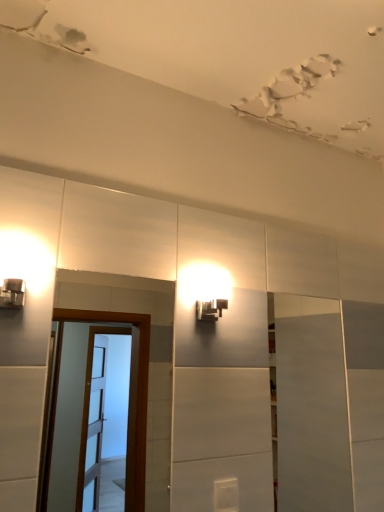
Question: Can you confirm if white plastic light switch at lower center is smaller than white glossy door at right?

Choices:
 (A) yes
 (B) no

Answer: (A)

Question: Is white plastic light switch at lower center with white glossy door at right?

Choices:
 (A) yes
 (B) no

Answer: (B)

Question: From the image's perspective, is white plastic light switch at lower center located above white glossy door at right?

Choices:
 (A) yes
 (B) no

Answer: (B)

Question: Is white plastic light switch at lower center to the right of white glossy door at right from the viewer's perspective?

Choices:
 (A) yes
 (B) no

Answer: (B)

Question: Is white plastic light switch at lower center thinner than white glossy door at right?

Choices:
 (A) no
 (B) yes

Answer: (A)

Question: From a real-world perspective, is white plastic light switch at lower center located beneath white glossy door at right?

Choices:
 (A) yes
 (B) no

Answer: (A)

Question: Could you tell me if white plastic light switch at lower center is facing matte black light fixture at upper center?

Choices:
 (A) no
 (B) yes

Answer: (A)

Question: Considering the relative sizes of white plastic light switch at lower center and matte black light fixture at upper center in the image provided, is white plastic light switch at lower center shorter than matte black light fixture at upper center?

Choices:
 (A) no
 (B) yes

Answer: (A)

Question: Is there a large distance between white plastic light switch at lower center and matte black light fixture at upper center?

Choices:
 (A) yes
 (B) no

Answer: (B)

Question: Can you confirm if white plastic light switch at lower center is positioned to the right of matte black light fixture at upper center?

Choices:
 (A) no
 (B) yes

Answer: (B)

Question: Is white plastic light switch at lower center positioned behind matte black light fixture at upper center?

Choices:
 (A) yes
 (B) no

Answer: (B)

Question: Considering the relative sizes of white plastic light switch at lower center and matte black light fixture at upper center in the image provided, is white plastic light switch at lower center taller than matte black light fixture at upper center?

Choices:
 (A) yes
 (B) no

Answer: (A)

Question: Considering the relative sizes of white glossy door at right and matte black light fixture at upper center in the image provided, is white glossy door at right bigger than matte black light fixture at upper center?

Choices:
 (A) no
 (B) yes

Answer: (B)